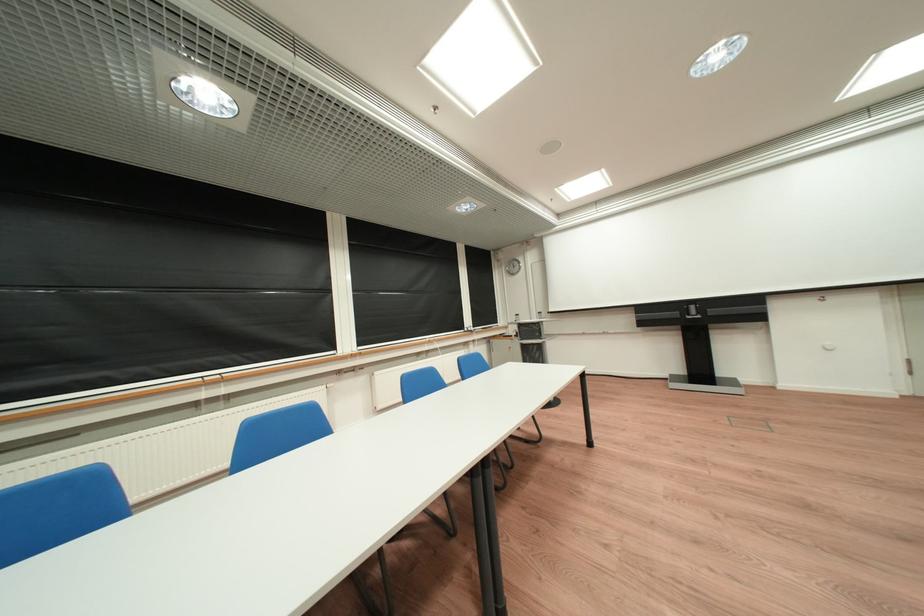
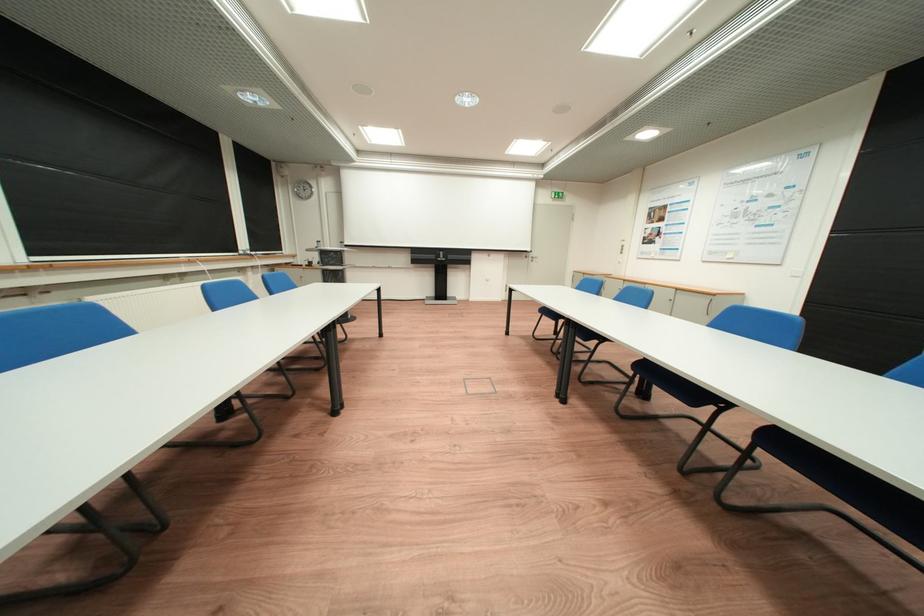
Question: The camera is either moving clockwise (left) or counter-clockwise (right) around the object. The first image is from the beginning of the video and the second image is from the end. Is the camera moving left or right when shooting the video?

Choices:
 (A) Left
 (B) Right

Answer: (A)